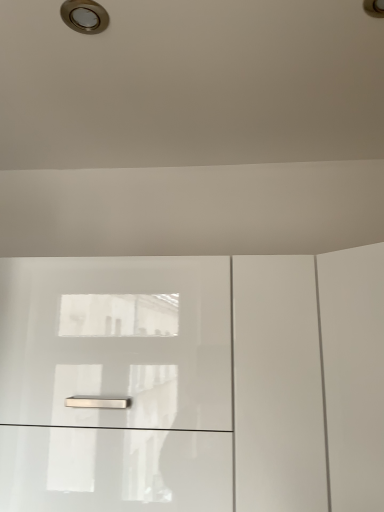
Question: From the image's perspective, is glossy white cabinet at center above or below brushed metal droplight at upper left?

Choices:
 (A) below
 (B) above

Answer: (A)

Question: Considering their positions, is glossy white cabinet at center located in front of or behind brushed metal droplight at upper left?

Choices:
 (A) front
 (B) behind

Answer: (B)

Question: Looking at the image, does glossy white cabinet at center seem bigger or smaller compared to brushed metal droplight at upper left?

Choices:
 (A) big
 (B) small

Answer: (A)

Question: Visually, is brushed metal droplight at upper left positioned to the left or to the right of glossy white cabinet at center?

Choices:
 (A) left
 (B) right

Answer: (A)

Question: In the image, is brushed metal droplight at upper left positioned in front of or behind glossy white cabinet at center?

Choices:
 (A) front
 (B) behind

Answer: (A)

Question: From the image's perspective, is brushed metal droplight at upper left positioned above or below glossy white cabinet at center?

Choices:
 (A) above
 (B) below

Answer: (A)

Question: Is brushed metal droplight at upper left taller or shorter than glossy white cabinet at center?

Choices:
 (A) tall
 (B) short

Answer: (B)